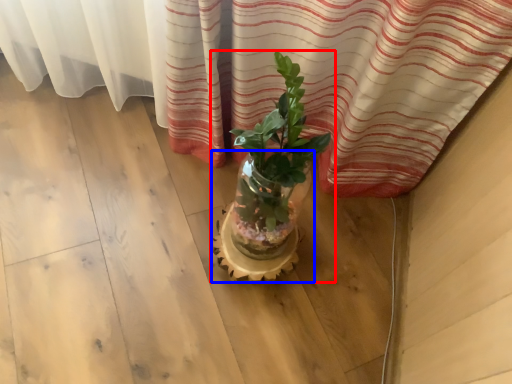
Question: Which of the following is the closest to the observer, houseplant (highlighted by a red box) or flowerpot (highlighted by a blue box)?

Choices:
 (A) houseplant
 (B) flowerpot

Answer: (A)